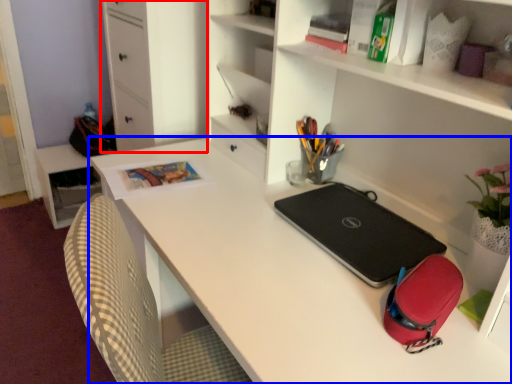
Question: Which point is further to the camera, file cabinet (highlighted by a red box) or desk (highlighted by a blue box)?

Choices:
 (A) file cabinet
 (B) desk

Answer: (A)